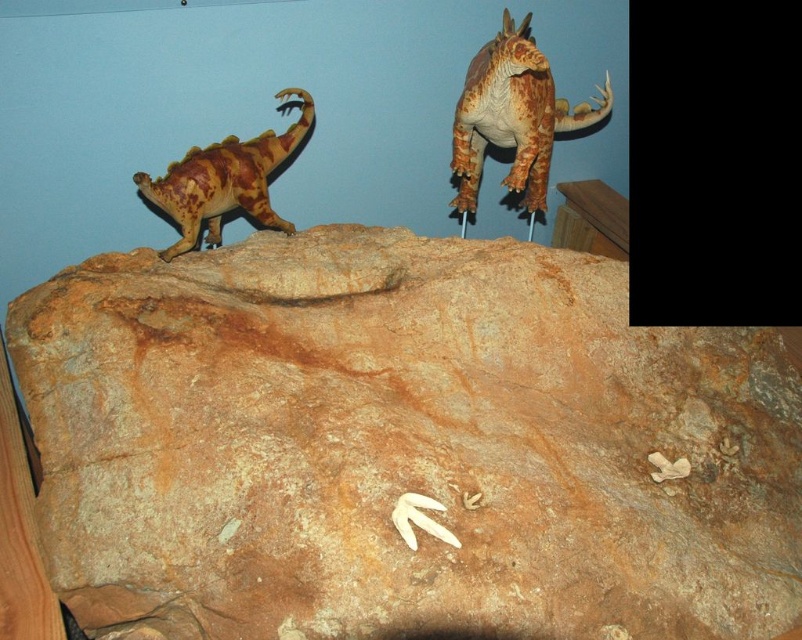
Question: Which of these objects is positioned closest to the rusty metallic dinosaur at upper right?

Choices:
 (A) brown rough rock at center
 (B) rustic wood dinosaur at left

Answer: (B)

Question: Does brown rough rock at center come in front of rustic wood dinosaur at left?

Choices:
 (A) yes
 (B) no

Answer: (A)

Question: Can you confirm if brown rough rock at center is wider than rustic wood dinosaur at left?

Choices:
 (A) no
 (B) yes

Answer: (B)

Question: Which of the following is the farthest from the observer?

Choices:
 (A) (286, 138)
 (B) (529, 211)

Answer: (B)

Question: Considering the real-world distances, which object is closest to the rustic wood dinosaur at left?

Choices:
 (A) rusty metallic dinosaur at upper right
 (B) brown rough rock at center

Answer: (B)

Question: Does brown rough rock at center have a smaller size compared to rusty metallic dinosaur at upper right?

Choices:
 (A) no
 (B) yes

Answer: (A)